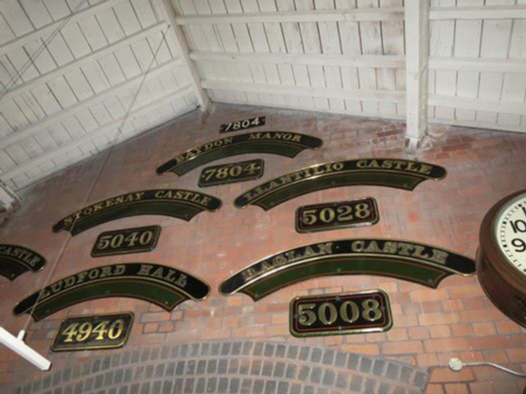
I want to click on wall, so click(x=332, y=39).